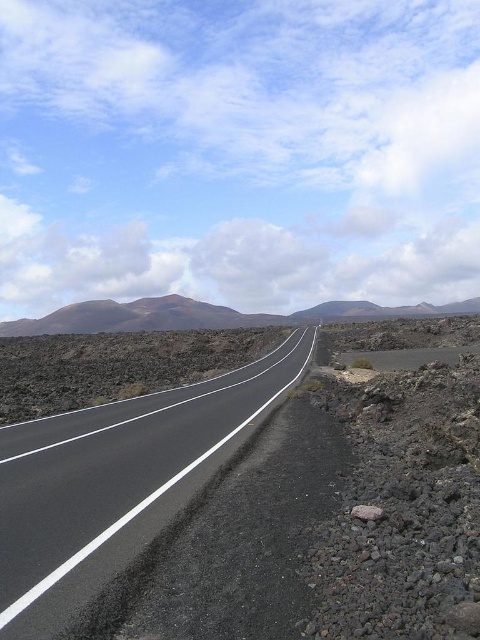
You are a drone pilot trying to locate the black asphalt highway at center for a delivery. According to the map, the highway is at coordinates 0.755, 0.244. Is the highway at the correct location?

The black asphalt highway at center is located at coordinates [117,483], so yes, it is at the correct location according to the map.

Based on the photo, you are a driver approaching the black asphalt highway at center and the brown volcanic rock at center. Which object will you encounter first?

The black asphalt highway at center is closer to the viewer than the brown volcanic rock at center, so you will encounter the black asphalt highway at center first.